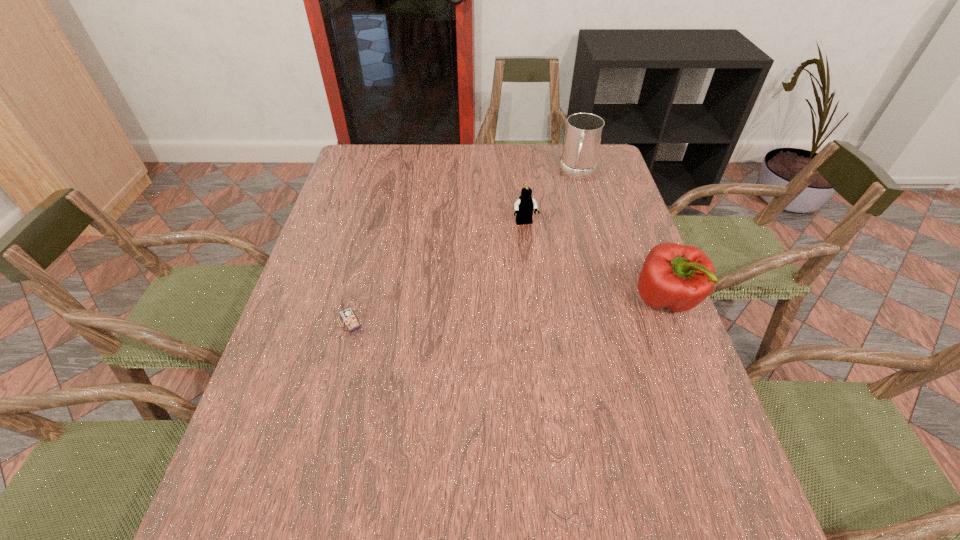
The height and width of the screenshot is (540, 960). I want to click on matchbox, so click(345, 313).

At what (x,y) coordinates should I click in order to perform the action: click on bell pepper. Please return your answer as a coordinate pair (x, y). Looking at the image, I should click on (679, 277).

What are the coordinates of `the farthest object` in the screenshot? It's located at (583, 133).

I want to click on Lego, so click(524, 206).

I want to click on the second farthest object, so click(524, 206).

Where is `free space located on the front of the leftmost object`? free space located on the front of the leftmost object is located at coordinates (335, 379).

Locate an element on the screen. This screenshot has height=540, width=960. free location located 0.100m on the front of the bell pepper is located at coordinates (689, 362).

Identify the location of vacant space located on the side of the mug with the handle. This screenshot has height=540, width=960. (562, 254).

Locate an element on the screen. This screenshot has height=540, width=960. free space located 0.190m on the side of the mug with the handle is located at coordinates (568, 223).

At what (x,y) coordinates should I click in order to perform the action: click on free spot located on the side of the mug with the handle. Please return your answer as a coordinate pair (x, y). The height and width of the screenshot is (540, 960). Looking at the image, I should click on (570, 217).